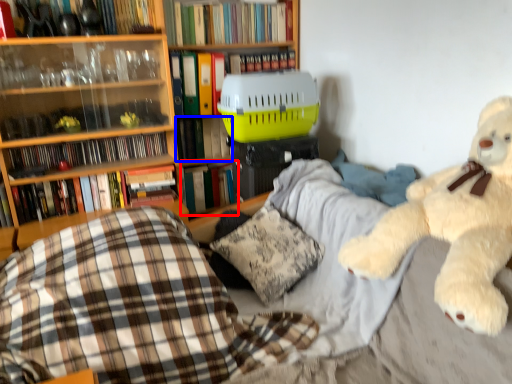
Question: Among these objects, which one is farthest to the camera, book (highlighted by a red box) or book (highlighted by a blue box)?

Choices:
 (A) book
 (B) book

Answer: (A)